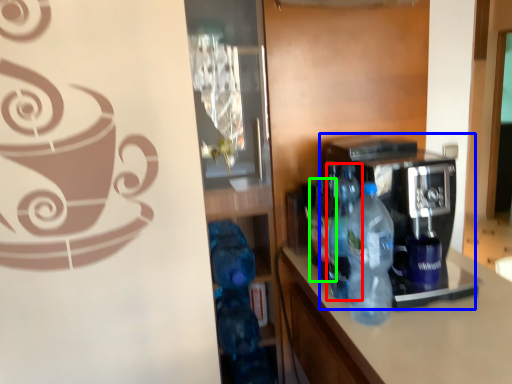
Question: Which object is the farthest from bottle (highlighted by a red box)? Choose among these: coffee machine (highlighted by a blue box) or bottle (highlighted by a green box).

Choices:
 (A) coffee machine
 (B) bottle

Answer: (A)